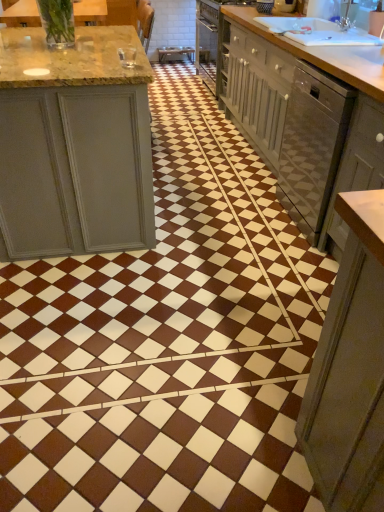
Question: Considering the relative positions of light brown wood countertop at upper right, acting as the first countertop starting from the right, and white glossy dishwasher at right in the image provided, is light brown wood countertop at upper right, acting as the first countertop starting from the right, to the right of white glossy dishwasher at right from the viewer's perspective?

Choices:
 (A) no
 (B) yes

Answer: (A)

Question: From the image's perspective, is light brown wood countertop at upper right, acting as the 2th countertop starting from the left, located beneath white glossy dishwasher at right?

Choices:
 (A) yes
 (B) no

Answer: (B)

Question: From a real-world perspective, is light brown wood countertop at upper right, which appears as the 2th countertop when viewed from the front, over white glossy dishwasher at right?

Choices:
 (A) no
 (B) yes

Answer: (B)

Question: Does light brown wood countertop at upper right, acting as the first countertop starting from the right, turn towards white glossy dishwasher at right?

Choices:
 (A) yes
 (B) no

Answer: (B)

Question: Is light brown wood countertop at upper right, acting as the first countertop starting from the right, facing away from white glossy dishwasher at right?

Choices:
 (A) yes
 (B) no

Answer: (B)

Question: Considering the relative positions of light brown wood countertop at upper right, which is the 1th countertop from back to front, and white glossy dishwasher at right in the image provided, is light brown wood countertop at upper right, which is the 1th countertop from back to front, behind white glossy dishwasher at right?

Choices:
 (A) no
 (B) yes

Answer: (B)

Question: Is white glossy dishwasher at right surrounded by matte gray cabinet at right?

Choices:
 (A) no
 (B) yes

Answer: (A)

Question: From a real-world perspective, is matte gray cabinet at right on top of white glossy dishwasher at right?

Choices:
 (A) yes
 (B) no

Answer: (A)

Question: Considering the relative positions of matte gray cabinet at right and white glossy dishwasher at right in the image provided, is matte gray cabinet at right to the left of white glossy dishwasher at right from the viewer's perspective?

Choices:
 (A) no
 (B) yes

Answer: (B)

Question: Is there a large distance between matte gray cabinet at right and white glossy dishwasher at right?

Choices:
 (A) no
 (B) yes

Answer: (A)

Question: Considering the relative sizes of matte gray cabinet at right and white glossy dishwasher at right in the image provided, is matte gray cabinet at right shorter than white glossy dishwasher at right?

Choices:
 (A) yes
 (B) no

Answer: (A)

Question: From the image's perspective, does matte gray cabinet at right appear lower than white glossy dishwasher at right?

Choices:
 (A) no
 (B) yes

Answer: (B)

Question: Is matte gray cabinet at right positioned behind translucent glass vase at upper left, arranged as the 2th countertop when viewed from the right?

Choices:
 (A) no
 (B) yes

Answer: (A)